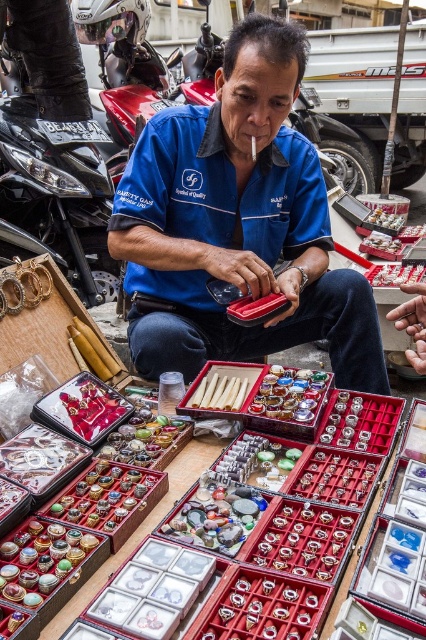
Locate an element on the screen. blue fabric shirt at center is located at coordinates (238, 225).

Who is shorter, blue fabric shirt at center or shiny gold ring at center?

shiny gold ring at center

Who is more distant from viewer, [278,232] or [302,392]?

Positioned behind is point [278,232].

You are a GUI agent. You are given a task and a screenshot of the screen. Output one action in this format:
    pyautogui.click(x=<x>, y=<y>)
    Task: Click on the blue fabric shirt at center
    The height and width of the screenshot is (640, 426).
    Given the screenshot: What is the action you would take?
    pyautogui.click(x=238, y=225)

Can you confirm if blue fabric shirt at center is positioned to the right of gold metallic bracelet at left?

Indeed, blue fabric shirt at center is positioned on the right side of gold metallic bracelet at left.

Between blue fabric shirt at center and gold metallic bracelet at left, which one is positioned higher?

blue fabric shirt at center is higher up.

Between point (285, 67) and point (20, 307), which one is positioned behind?

Positioned behind is point (20, 307).

The width and height of the screenshot is (426, 640). Find the location of `blue fabric shirt at center`. blue fabric shirt at center is located at coordinates (238, 225).

Who is shorter, shiny gold ring at center or gold metallic bracelet at left?

Standing shorter between the two is shiny gold ring at center.

How much distance is there between shiny gold ring at center and gold metallic bracelet at left?

shiny gold ring at center and gold metallic bracelet at left are 95.00 centimeters apart from each other.

Between point (261, 384) and point (37, 292), which one is positioned behind?

Positioned behind is point (37, 292).

The height and width of the screenshot is (640, 426). I want to click on shiny gold ring at center, so click(x=290, y=394).